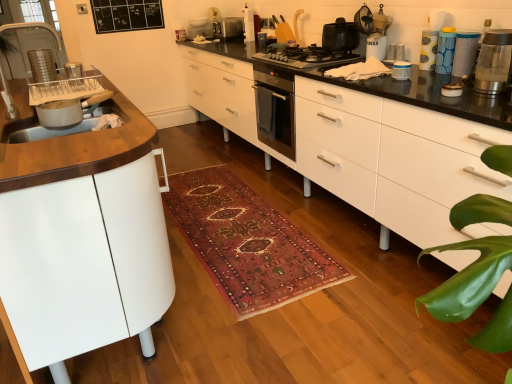
At what (x,y) coordinates should I click in order to perform the action: click on vacant space to the left of white ceramic mug at upper center, which ranks as the second appliance in back-to-front order. Please return your answer as a coordinate pair (x, y). Looking at the image, I should click on (347, 57).